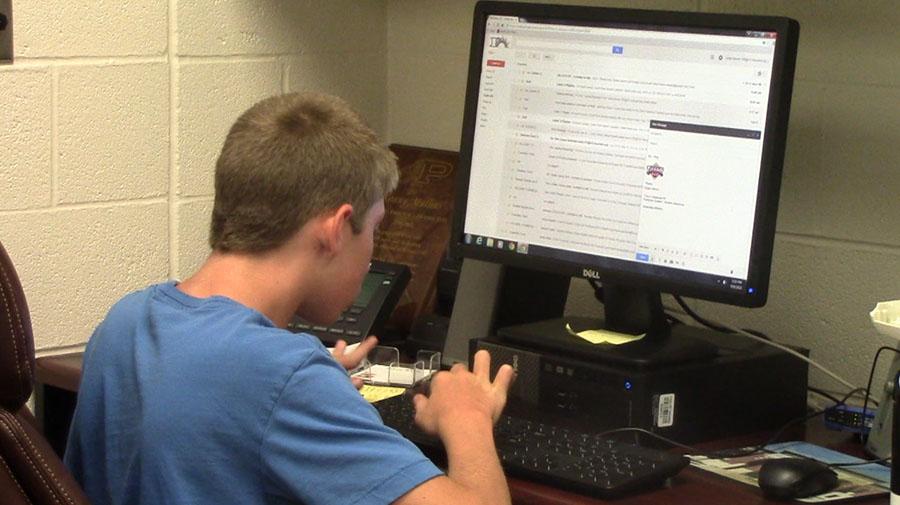
Identify the location of cables. (706, 324), (767, 444), (877, 460).